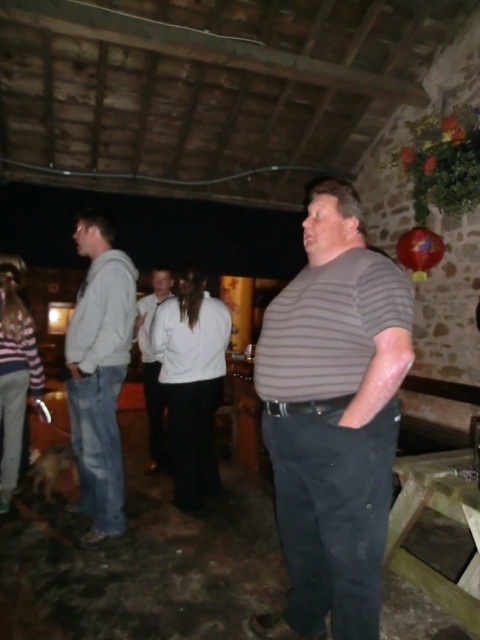
Which is above, gray striped shirt at center or white matte jacket at center?

Positioned higher is white matte jacket at center.

Is point (299, 305) positioned behind point (155, 376)?

No, it is in front of (155, 376).

This screenshot has width=480, height=640. Identify the location of gray striped shirt at center. (333, 419).

From the picture: Between gray striped shirt at center and light gray hoodie at left, which one has more height?

Standing taller between the two is light gray hoodie at left.

Does gray striped shirt at center appear on the right side of light gray hoodie at left?

Indeed, gray striped shirt at center is positioned on the right side of light gray hoodie at left.

Between point (323, 272) and point (84, 333), which one is positioned behind?

The point (84, 333) is more distant.

Where is `gray striped shirt at center`? gray striped shirt at center is located at coordinates [x=333, y=419].

Does point (92, 289) come behind point (149, 298)?

No, it is in front of (149, 298).

Does point (72, 388) come closer to viewer compared to point (142, 308)?

That is True.

Locate an element on the screen. light gray hoodie at left is located at coordinates (99, 372).